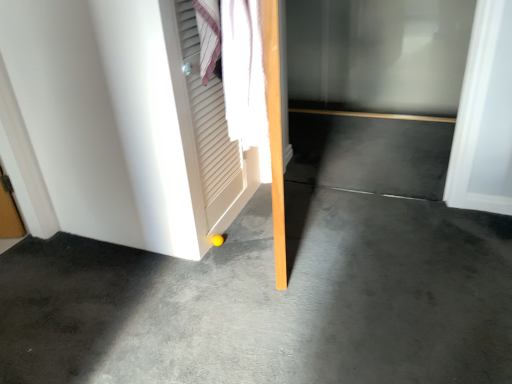
What is the approximate height of transparent glass door at center?

The height of transparent glass door at center is 34.97 inches.

What is the approximate height of gray concrete at center?

gray concrete at center is 8.74 centimeters in height.

At what (x,y) coordinates should I click in order to perform the action: click on transparent glass door at center. Please return your answer as a coordinate pair (x, y). The image size is (512, 384). Looking at the image, I should click on (378, 54).

In terms of height, does gray concrete at center look taller or shorter compared to transparent glass door at center?

Considering their sizes, gray concrete at center has less height than transparent glass door at center.

The image size is (512, 384). Identify the location of glass door behind the gray concrete at center. (378, 54).

Is transparent glass door at center completely or partially inside gray concrete at center?

Result: No, gray concrete at center does not contain transparent glass door at center.

Would you say gray concrete at center is to the left or to the right of transparent glass door at center in the picture?

Based on their positions, gray concrete at center is located to the left of transparent glass door at center.

Where is `glass door behind the white louvered screen door at upper left`? The width and height of the screenshot is (512, 384). glass door behind the white louvered screen door at upper left is located at coordinates [378, 54].

Which object is wider, white louvered screen door at upper left or transparent glass door at center?

white louvered screen door at upper left.

Does point (190, 103) come behind point (439, 20)?

No, it is in front of (439, 20).

Are matte white door at lower left and white louvered screen door at upper left beside each other?

No, matte white door at lower left is not with white louvered screen door at upper left.

Is matte white door at lower left positioned with its back to white louvered screen door at upper left?

No, white louvered screen door at upper left is not at the back of matte white door at lower left.

Does matte white door at lower left have a lesser width compared to white louvered screen door at upper left?

Incorrect, the width of matte white door at lower left is not less than that of white louvered screen door at upper left.

In the image, is matte white door at lower left positioned in front of or behind white louvered screen door at upper left?

matte white door at lower left is behind white louvered screen door at upper left.

Is the position of white louvered screen door at upper left more distant than that of gray concrete at center?

Yes, it is behind gray concrete at center.

Based on the photo, would you consider white louvered screen door at upper left to be distant from gray concrete at center?

They are positioned close to each other.

Looking at the image, does white louvered screen door at upper left seem bigger or smaller compared to gray concrete at center?

Considering their sizes, white louvered screen door at upper left takes up less space than gray concrete at center.

Could you tell me if white louvered screen door at upper left is turned towards gray concrete at center?

No, white louvered screen door at upper left does not turn towards gray concrete at center.

Between transparent glass door at center and white louvered screen door at upper left, which one has larger size?

Bigger between the two is transparent glass door at center.

Is white louvered screen door at upper left surrounded by transparent glass door at center?

No, white louvered screen door at upper left is located outside of transparent glass door at center.

Looking at this image, from a real-world perspective, between transparent glass door at center and white louvered screen door at upper left, who is vertically higher?

In real-world perspective, white louvered screen door at upper left is above.

Is transparent glass door at center touching white louvered screen door at upper left?

No, transparent glass door at center is not touching white louvered screen door at upper left.

Is matte white door at lower left completely or partially inside transparent glass door at center?

No, matte white door at lower left is not surrounded by transparent glass door at center.

This screenshot has width=512, height=384. In order to click on door above the transparent glass door at center (from a real-world perspective) in this screenshot , I will do `click(119, 124)`.

Considering the sizes of objects transparent glass door at center and matte white door at lower left in the image provided, who is taller, transparent glass door at center or matte white door at lower left?

Standing taller between the two is matte white door at lower left.

From the image's perspective, which one is positioned higher, matte white door at lower left or gray concrete at center?

matte white door at lower left.

Is matte white door at lower left closer to camera compared to gray concrete at center?

No.

Is matte white door at lower left positioned beyond the bounds of gray concrete at center?

Absolutely, matte white door at lower left is external to gray concrete at center.

How different are the orientations of matte white door at lower left and gray concrete at center in degrees?

89.5 degrees.

The width and height of the screenshot is (512, 384). Find the location of `concrete on the left of transparent glass door at center`. concrete on the left of transparent glass door at center is located at coordinates (271, 300).

You are a GUI agent. You are given a task and a screenshot of the screen. Output one action in this format:
    pyautogui.click(x=<x>, y=<y>)
    Task: Click on the screen door above the transparent glass door at center (from a real-world perspective)
    The height and width of the screenshot is (384, 512).
    Given the screenshot: What is the action you would take?
    pyautogui.click(x=206, y=127)

From the image, which object appears to be nearer to matte white door at lower left, gray concrete at center or transparent glass door at center?

Among the two, gray concrete at center is located nearer to matte white door at lower left.

Based on their spatial positions, is matte white door at lower left or white louvered screen door at upper left further from gray concrete at center?

Among the two, white louvered screen door at upper left is located further to gray concrete at center.

Based on their spatial positions, is matte white door at lower left or transparent glass door at center further from gray concrete at center?

Based on the image, transparent glass door at center appears to be further to gray concrete at center.

From the image, which object appears to be nearer to matte white door at lower left, gray concrete at center or white louvered screen door at upper left?

white louvered screen door at upper left lies closer to matte white door at lower left than the other object.

Considering their positions, is white louvered screen door at upper left positioned closer to gray concrete at center than matte white door at lower left?

matte white door at lower left is positioned closer to the anchor gray concrete at center.

Estimate the real-world distances between objects in this image. Which object is further from matte white door at lower left, white louvered screen door at upper left or transparent glass door at center?

transparent glass door at center.

Estimate the real-world distances between objects in this image. Which object is further from white louvered screen door at upper left, matte white door at lower left or gray concrete at center?

gray concrete at center is further to white louvered screen door at upper left.

Estimate the real-world distances between objects in this image. Which object is further from transparent glass door at center, white louvered screen door at upper left or matte white door at lower left?

matte white door at lower left lies further to transparent glass door at center than the other object.

Image resolution: width=512 pixels, height=384 pixels. Identify the location of screen door situated between matte white door at lower left and transparent glass door at center from left to right. (206, 127).

The image size is (512, 384). In order to click on concrete situated between matte white door at lower left and transparent glass door at center from left to right in this screenshot , I will do `click(271, 300)`.

Locate an element on the screen. Image resolution: width=512 pixels, height=384 pixels. screen door between matte white door at lower left and gray concrete at center in the vertical direction is located at coordinates (206, 127).

What are the coordinates of `screen door between transparent glass door at center and gray concrete at center in the vertical direction` in the screenshot? It's located at (206, 127).